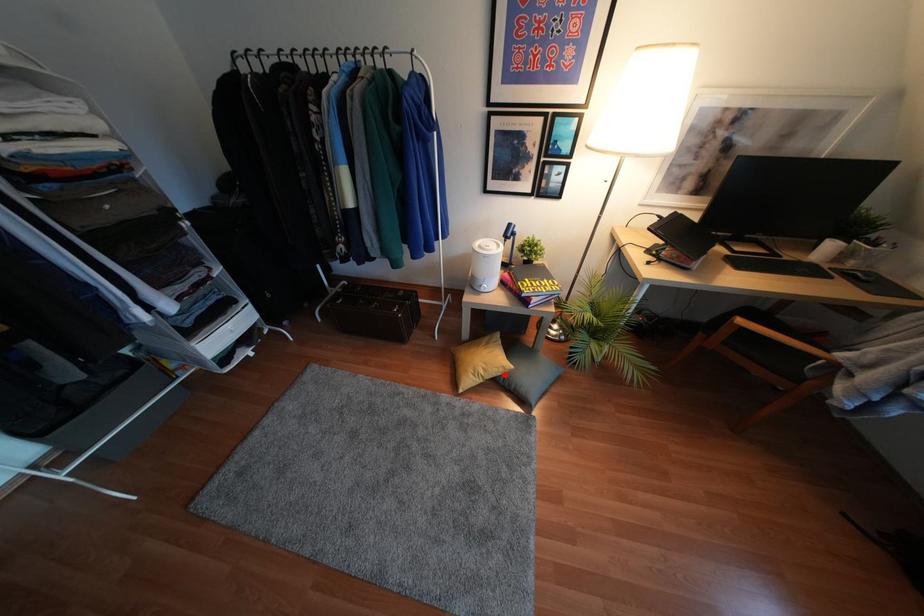
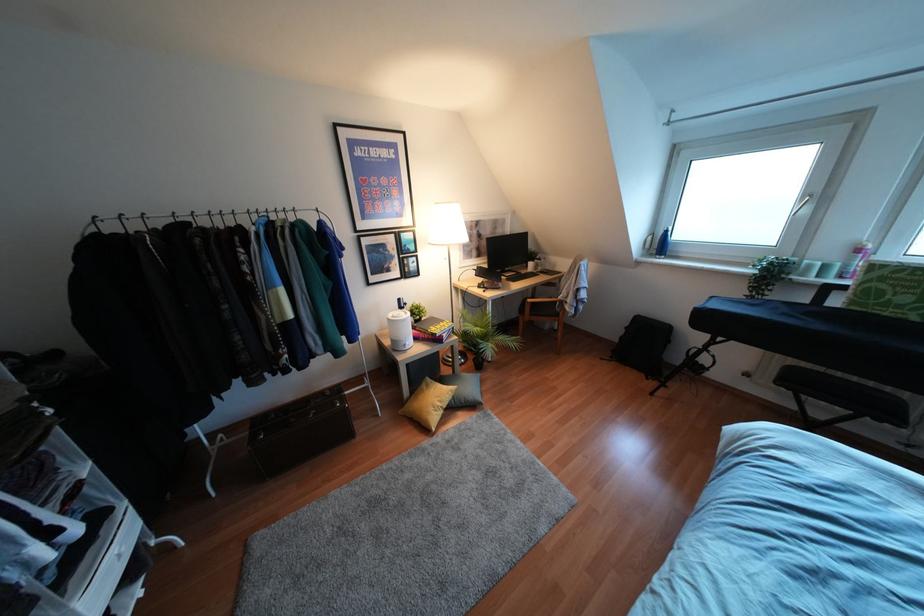
The point at the highlighted location is marked in the first image. Where is the corresponding point in the second image?

(453, 397)